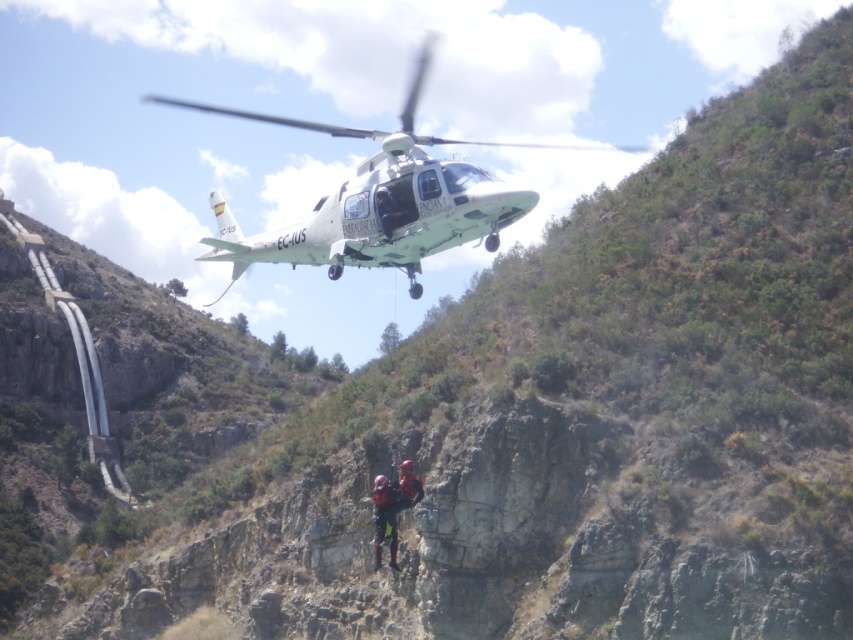
Image resolution: width=853 pixels, height=640 pixels. What do you see at coordinates (380, 200) in the screenshot?
I see `camouflage paint helicopter at center` at bounding box center [380, 200].

Is point (308, 129) farther from viewer compared to point (405, 508)?

Yes, point (308, 129) is behind point (405, 508).

Find the location of `camouflage paint helicopter at center`. camouflage paint helicopter at center is located at coordinates (380, 200).

Between camouflage paint helicopter at center and camouflage fabric helmet at center, which one appears on the left side from the viewer's perspective?

camouflage paint helicopter at center is more to the left.

Between camouflage paint helicopter at center and camouflage fabric helmet at center, which one has more height?

camouflage paint helicopter at center

Does point (421, 52) come in front of point (387, 516)?

No, it is behind (387, 516).

The image size is (853, 640). Identify the location of camouflage paint helicopter at center. (380, 200).

Between black rubber helmet at center and camouflage fabric helmet at center, which one appears on the right side from the viewer's perspective?

Positioned to the right is black rubber helmet at center.

Which is behind, point (393, 570) or point (396, 568)?

The point (393, 570) is behind.

At what (x,y) coordinates should I click in order to perform the action: click on black rubber helmet at center. Please return your answer as a coordinate pair (x, y). This screenshot has height=640, width=853. Looking at the image, I should click on (392, 508).